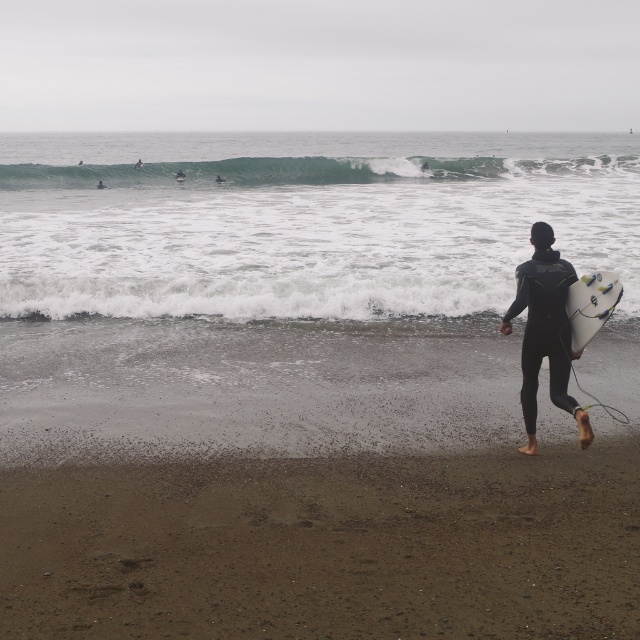
You are a photographer standing at the shoreline and want to capture the two points in the image. Which point, point (x=426, y=550) or point (x=492, y=170), will appear larger in your photo?

Point (x=426, y=550) is closer to the viewer than point (x=492, y=170), so it will appear larger in the photo.

You are a drone operator trying to capture the surfer walking along the shoreline. You need to position two markers on the image at coordinates point (x=84, y=278) and point (x=236, y=182). From the surfer walking towards the ocean, which marker is closer to the surfer?

Point (x=84, y=278) is in front of point (x=236, y=182), so the marker at point (x=84, y=278) is closer to the surfer walking towards the ocean.